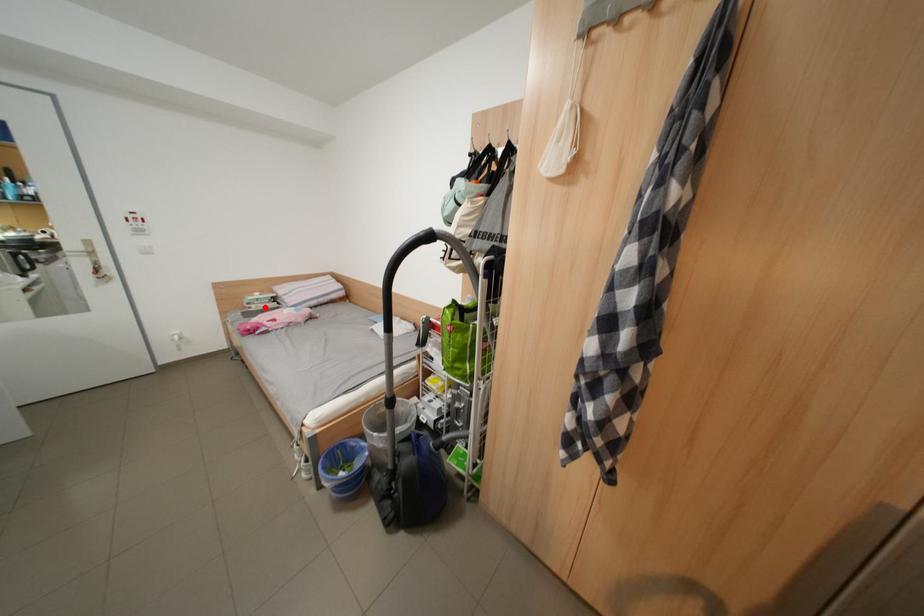
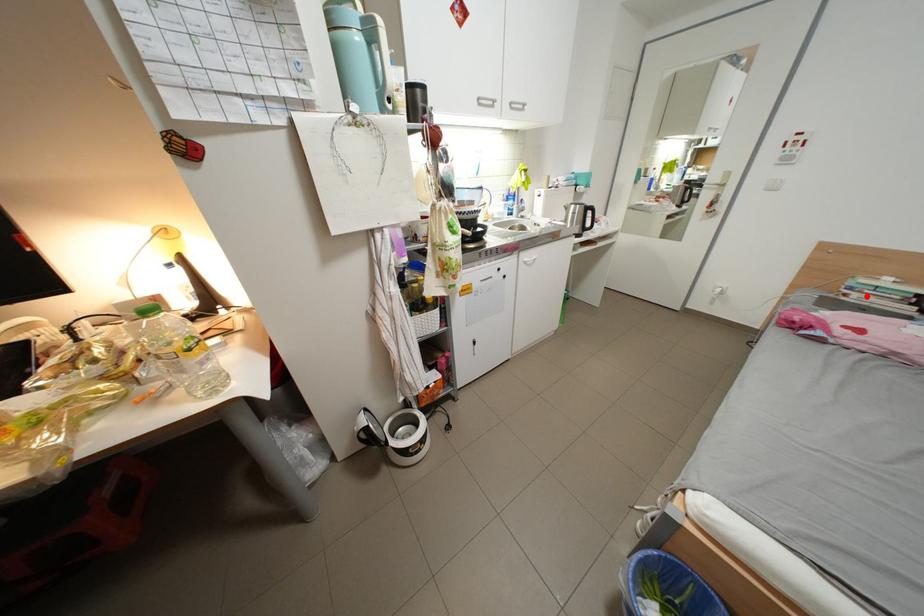
I am providing you with two images of the same scene from different viewpoints. A red point is marked on the first image and another point is marked on the second image. Do the highlighted points in image1 and image2 indicate the same real-world spot?

Yes